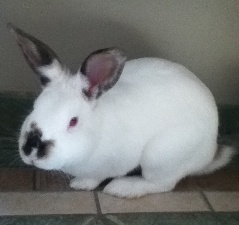
The width and height of the screenshot is (239, 225). What are the coordinates of `tile floor` in the screenshot? It's located at (73, 207).